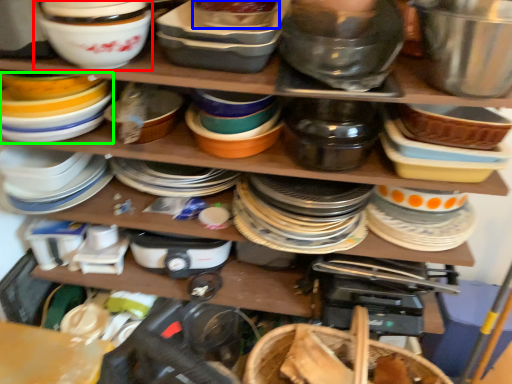
Question: Based on their relative distances, which object is farther from bowl (highlighted by a red box)? Choose from bowl (highlighted by a blue box) and appliance (highlighted by a green box).

Choices:
 (A) bowl
 (B) appliance

Answer: (A)